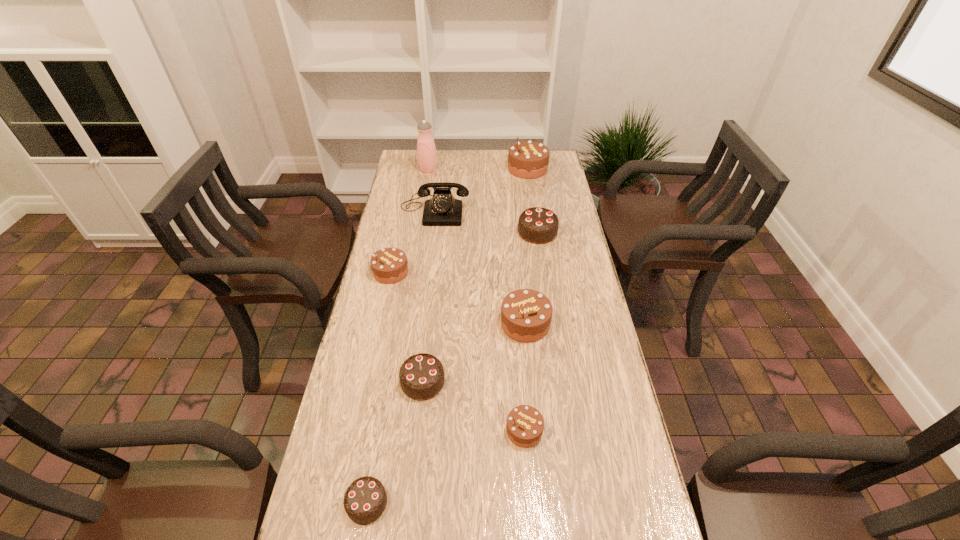
The image size is (960, 540). Identify the location of free region located 0.390m on the left of the sixth nearest chocolate cake. pyautogui.click(x=414, y=232).

Find the location of `vacant region located 0.090m on the right of the second smallest brown chocolate cake`. vacant region located 0.090m on the right of the second smallest brown chocolate cake is located at coordinates coord(435,272).

I want to click on free space located on the back of the second nearest chocolate chocolate cake, so click(433, 291).

This screenshot has width=960, height=540. I want to click on vacant region located 0.050m on the right of the smallest brown chocolate cake, so click(563, 430).

In order to click on blank space located on the right of the nearest object in this screenshot , I will do click(x=420, y=503).

You are a GUI agent. You are given a task and a screenshot of the screen. Output one action in this format:
    pyautogui.click(x=<x>, y=<y>)
    Task: Click on the thermos bottle that is at the far edge
    
    Given the screenshot: What is the action you would take?
    pyautogui.click(x=426, y=151)

Find the location of a particular element. chocolate cake present at the far edge is located at coordinates (527, 159).

Image resolution: width=960 pixels, height=540 pixels. Identify the location of thermos bottle at the left edge. (426, 151).

In order to click on telephone that is at the left edge in this screenshot , I will do `click(442, 209)`.

Find the location of a particular element. This screenshot has width=960, height=540. object that is at the far left corner is located at coordinates (426, 151).